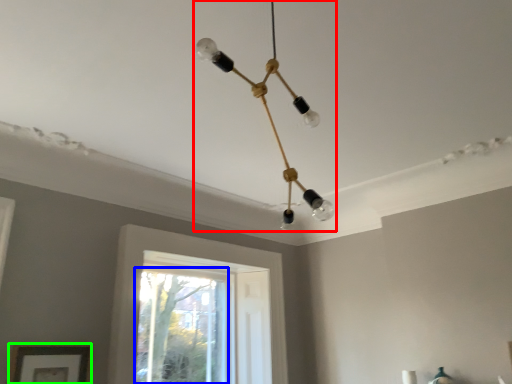
Question: Which object is positioned farthest from lamp (highlighted by a red box)? Select from window (highlighted by a blue box) and picture frame (highlighted by a green box).

Choices:
 (A) window
 (B) picture frame

Answer: (A)